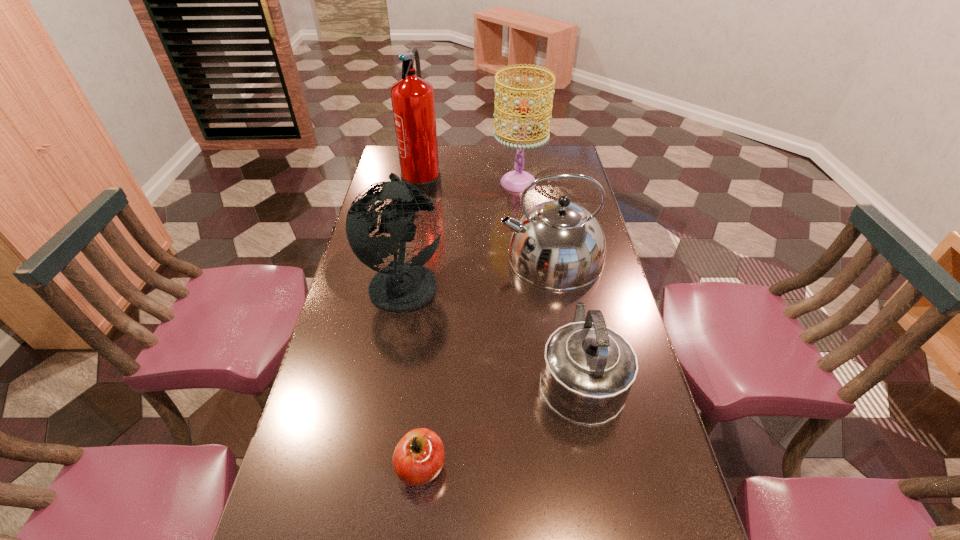
Find the location of a particular element. The height and width of the screenshot is (540, 960). the tallest object is located at coordinates 412,97.

Where is `the fifth shortest object`? This screenshot has width=960, height=540. the fifth shortest object is located at coordinates (516, 181).

Locate an element on the screen. This screenshot has height=540, width=960. globe is located at coordinates (401, 287).

Locate an element on the screen. This screenshot has width=960, height=540. the taller kettle is located at coordinates (558, 245).

The width and height of the screenshot is (960, 540). In order to click on the second shortest object in this screenshot , I will do `click(588, 369)`.

The width and height of the screenshot is (960, 540). I want to click on the fifth farthest object, so click(588, 369).

The width and height of the screenshot is (960, 540). Find the location of `the nearest object`. the nearest object is located at coordinates (418, 458).

This screenshot has height=540, width=960. I want to click on the shortest object, so click(418, 458).

At what (x,y) coordinates should I click in order to perform the action: click on vacant region located 0.060m on the right of the tallest object. Please return your answer as a coordinate pair (x, y). This screenshot has height=540, width=960. Looking at the image, I should click on (456, 179).

Image resolution: width=960 pixels, height=540 pixels. I want to click on vacant position located on the left of the lampshade, so click(x=426, y=183).